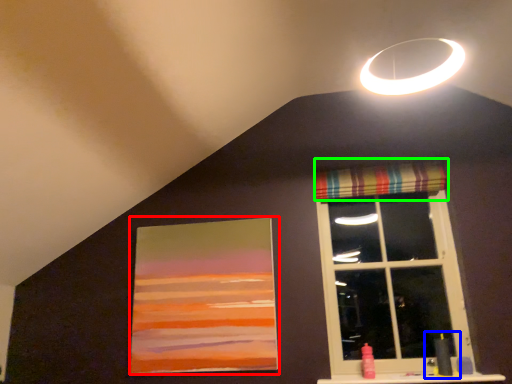
Question: Estimate the real-world distances between objects in this image. Which object is farther from picture frame (highlighted by a red box), sink (highlighted by a blue box) or curtain (highlighted by a green box)?

Choices:
 (A) sink
 (B) curtain

Answer: (A)